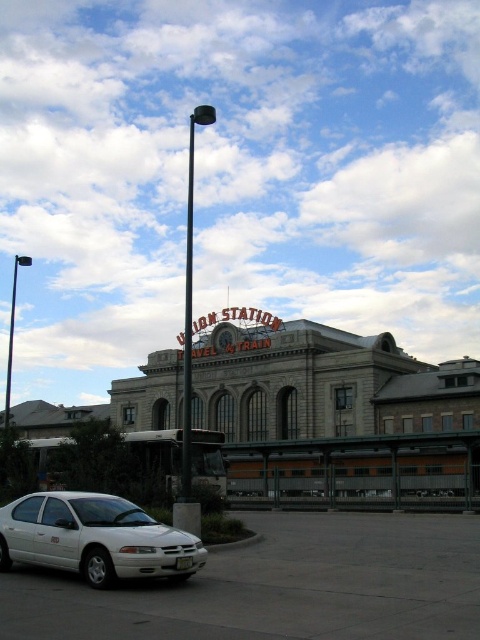
You are a visitor at Union Station and want to park your car. You see the white matte sedan at lower left and the black metal pole at upper left. Which object is closer to the entrance of the station?

The white matte sedan at lower left is positioned under the black metal pole at upper left, so the sedan is closer to the entrance than the pole.

You are standing in front of Union Station and need to locate the black metal pole at upper left and the stone building at center. According to the scene, which object is closer to the left edge of the frame?

The black metal pole at upper left is closer to the left edge of the frame because the stone building at center is positioned to its right side.